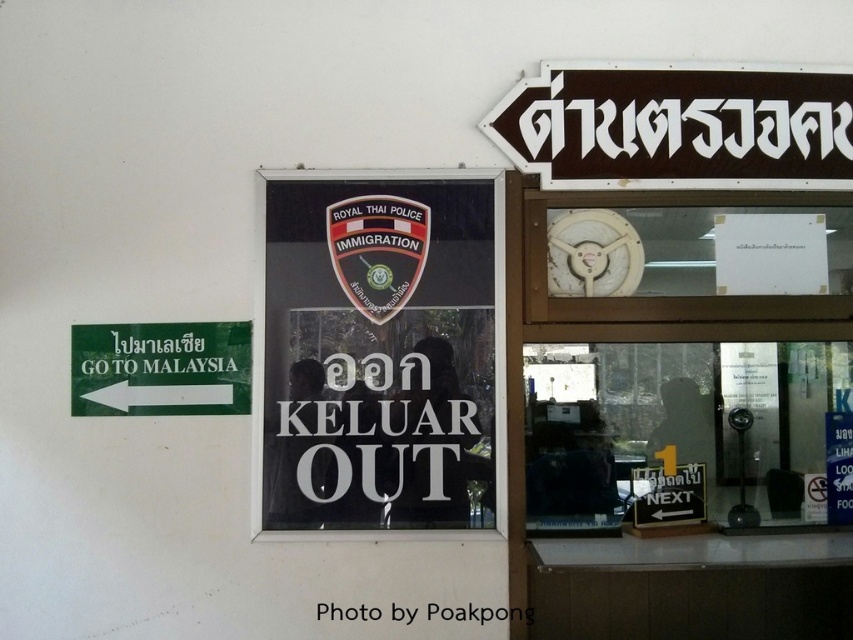
Question: Based on their relative distances, which object is nearer to the white paper at upper center?

Choices:
 (A) green matte sign at left
 (B) brownmaterial/texturesignage at upper right
 (C) transparent glass window at center
 (D) transparent glass sign at center

Answer: (D)

Question: Does transparent glass sign at center have a greater width compared to brownmaterial/texturesignage at upper right?

Choices:
 (A) yes
 (B) no

Answer: (B)

Question: Which point is farther from the camera taking this photo?

Choices:
 (A) (672, 515)
 (B) (215, 412)

Answer: (A)

Question: Which of the following is the closest to the observer?

Choices:
 (A) (349, 609)
 (B) (538, 352)
 (C) (195, 410)
 (D) (444, 323)

Answer: (A)

Question: Is brownmaterial/texturesignage at upper right wider than green matte sign at left?

Choices:
 (A) no
 (B) yes

Answer: (B)

Question: Can you confirm if transparent glass window at center is positioned below white paper at upper center?

Choices:
 (A) yes
 (B) no

Answer: (B)